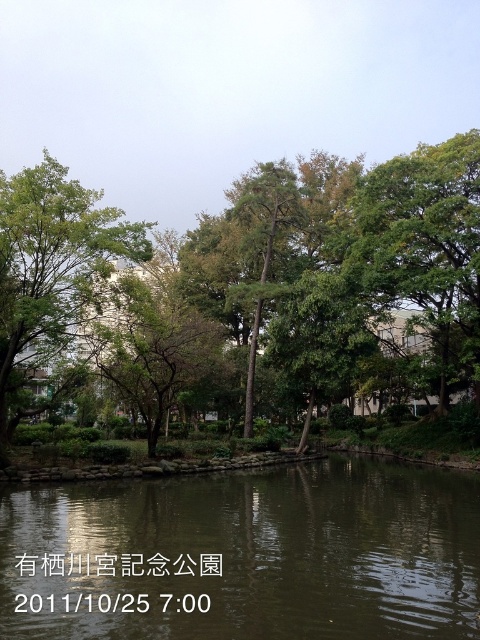
Question: In this image, where is green leafy tree at center located relative to green leafy tree at left?

Choices:
 (A) right
 (B) left

Answer: (A)

Question: Is green reflective water at center further to camera compared to green leafy tree at right?

Choices:
 (A) no
 (B) yes

Answer: (A)

Question: Among these points, which one is nearest to the camera?

Choices:
 (A) (8, 371)
 (B) (448, 221)
 (C) (339, 269)

Answer: (A)

Question: Which point is closer to the camera?

Choices:
 (A) green leafy tree at left
 (B) green leafy tree at right
 (C) green reflective water at center
 (D) green leafy tree at center

Answer: (C)

Question: Is green reflective water at center closer to camera compared to green leafy tree at left?

Choices:
 (A) no
 (B) yes

Answer: (B)

Question: Which object is farther from the camera taking this photo?

Choices:
 (A) green leafy tree at center
 (B) green reflective water at center
 (C) green leafy tree at left
 (D) green leafy tree at right

Answer: (D)